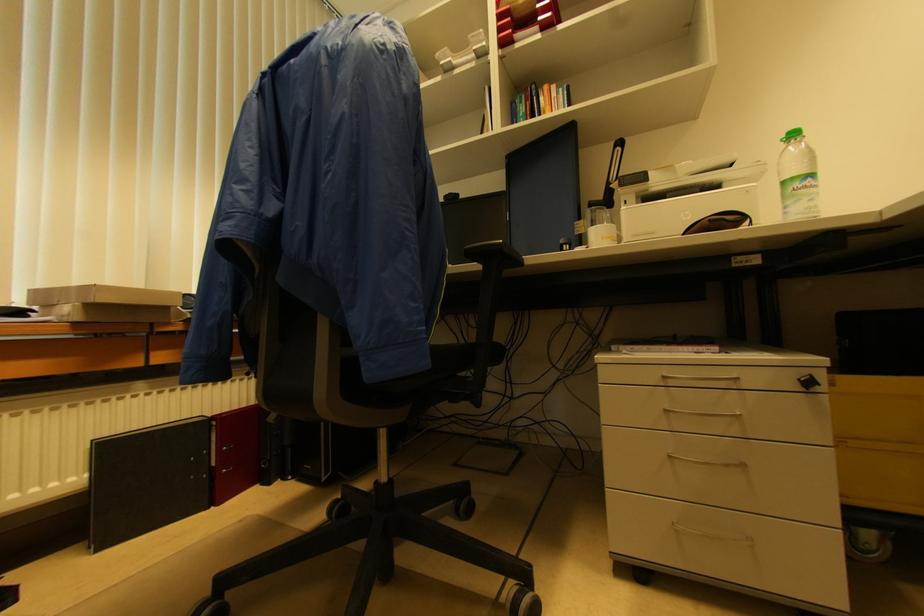
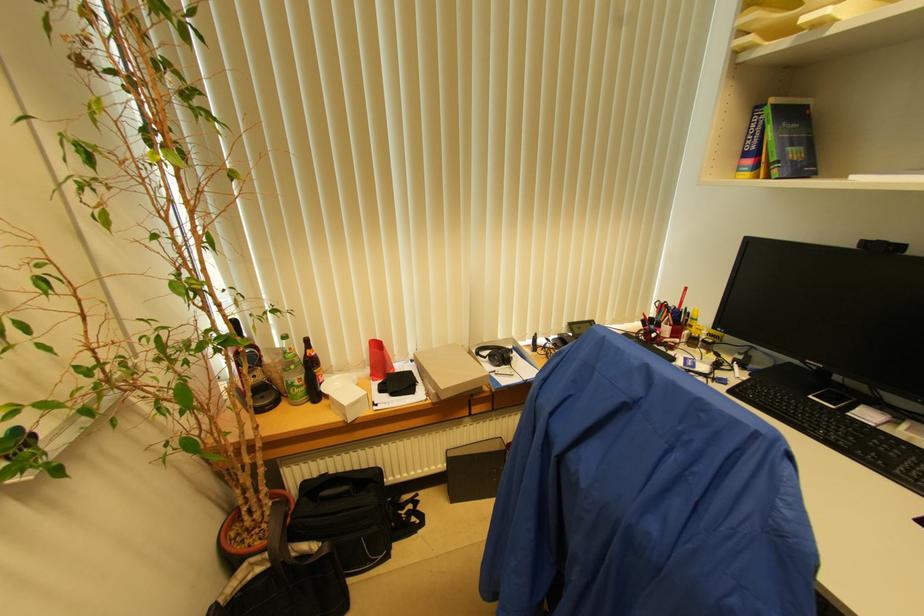
Locate, in the second image, the point that corresponds to (x=93, y=444) in the first image.

(447, 453)